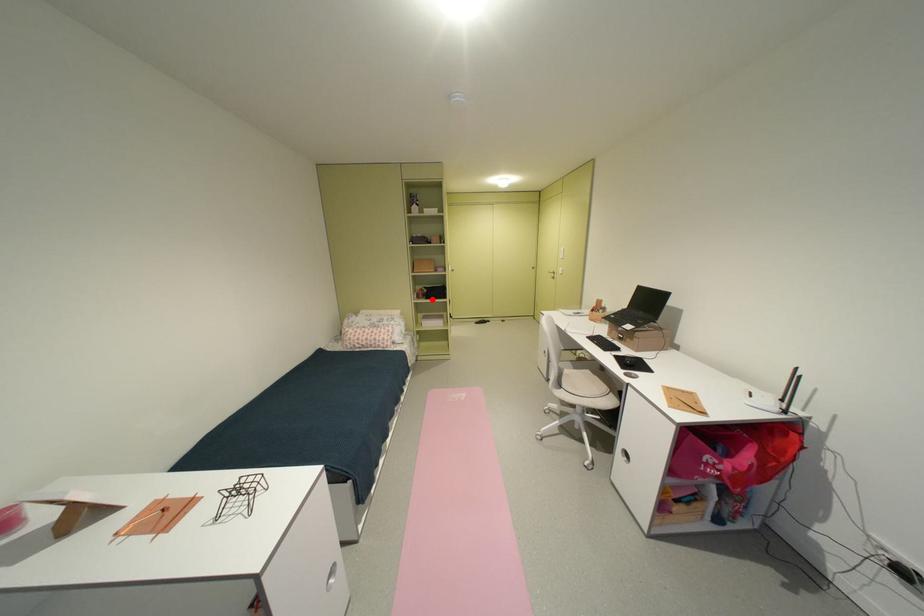
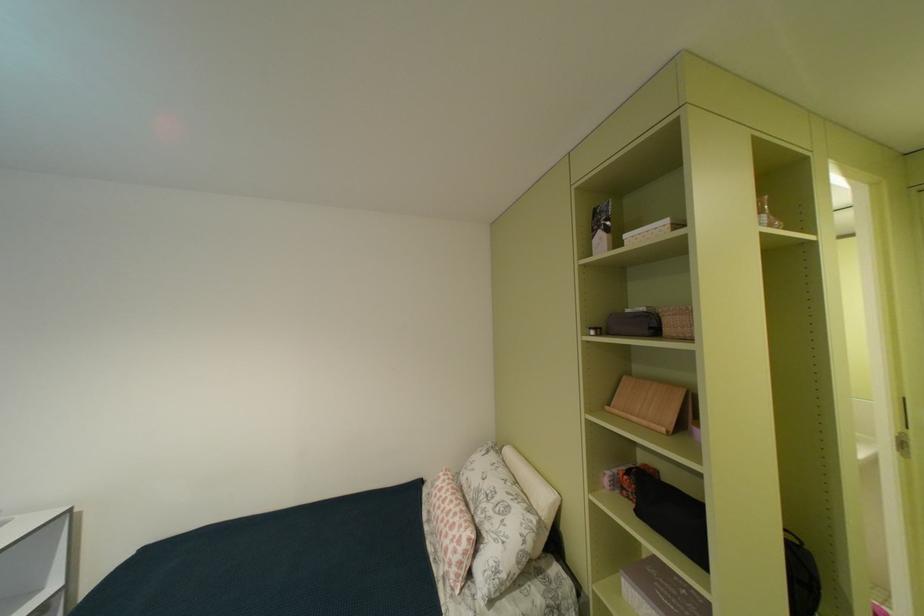
Where in the second image is the point corresponding to the highlighted location from the first image?

(641, 501)